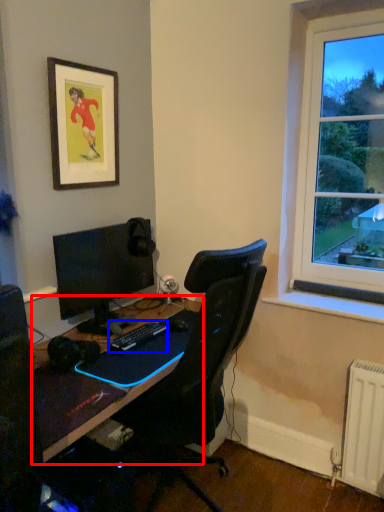
Question: Which object is further to the camera taking this photo, desk (highlighted by a red box) or computer keyboard (highlighted by a blue box)?

Choices:
 (A) desk
 (B) computer keyboard

Answer: (B)